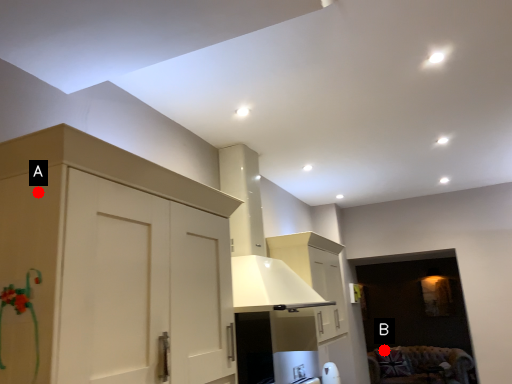
Question: Two points are circled on the image, labeled by A and B beside each circle. Which point is farther to the camera?

Choices:
 (A) A is further
 (B) B is further

Answer: (B)